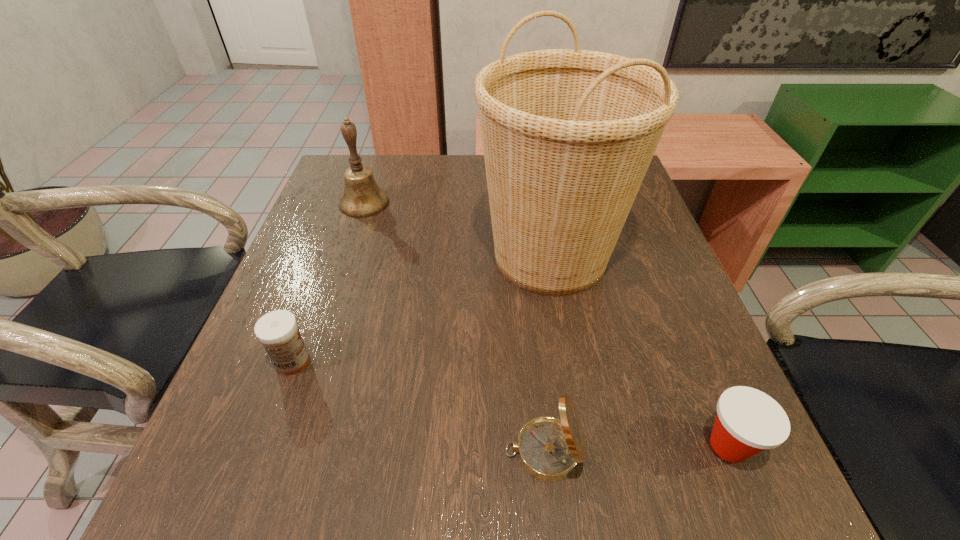
Find the location of a particular element. the tallest object is located at coordinates (568, 135).

Find the location of a particular element. This screenshot has width=960, height=540. bell is located at coordinates (362, 197).

Find the location of `compass`. compass is located at coordinates (548, 448).

Where is `the third nearest object`? This screenshot has width=960, height=540. the third nearest object is located at coordinates (278, 331).

At what (x,y) coordinates should I click in order to perform the action: click on Dixie cup. Please return your answer as a coordinate pair (x, y). Looking at the image, I should click on (748, 421).

This screenshot has height=540, width=960. I want to click on vacant area situated on the front of the tallest object, so click(x=566, y=350).

Identify the location of blank space located 0.260m on the front of the fourth shortest object. The image size is (960, 540). (333, 296).

Find the location of a particular element. This screenshot has width=960, height=540. vacant area located 0.130m with the dial facing the compass is located at coordinates (417, 451).

In order to click on free spot located with the dial facing the compass in this screenshot , I will do `click(410, 451)`.

Locate an element on the screen. The height and width of the screenshot is (540, 960). vacant position located with the dial facing the compass is located at coordinates (328, 451).